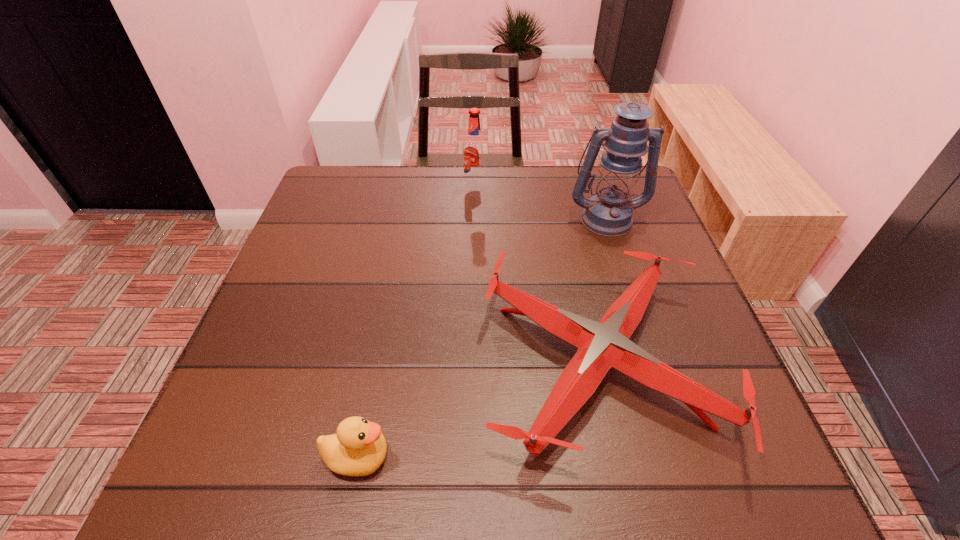
In the image, there is a desktop. What are the coordinates of `free space at the left edge` in the screenshot? It's located at (361, 240).

The height and width of the screenshot is (540, 960). Identify the location of vacant space at the right edge of the desktop. (691, 415).

At what (x,y) coordinates should I click in order to perform the action: click on vacant space at the near left corner of the desktop. Please return your answer as a coordinate pair (x, y). This screenshot has height=540, width=960. Looking at the image, I should click on (260, 484).

The width and height of the screenshot is (960, 540). What are the coordinates of `vacant space at the far right corner` in the screenshot? It's located at (596, 171).

The width and height of the screenshot is (960, 540). Identify the location of vacant space in between the drone and the lantern. (602, 291).

Locate an element on the screen. The width and height of the screenshot is (960, 540). free space between the duck and the third nearest object is located at coordinates (482, 338).

This screenshot has height=540, width=960. In order to click on vacant area between the farthest object and the drone in this screenshot , I will do `click(537, 274)`.

The image size is (960, 540). In order to click on free space that is in between the third shortest object and the tallest object in this screenshot , I will do `click(540, 202)`.

Find the location of `empty space between the lantern and the leftmost object`. empty space between the lantern and the leftmost object is located at coordinates (482, 338).

Locate an element on the screen. empty space that is in between the second tallest object and the third nearest object is located at coordinates (540, 202).